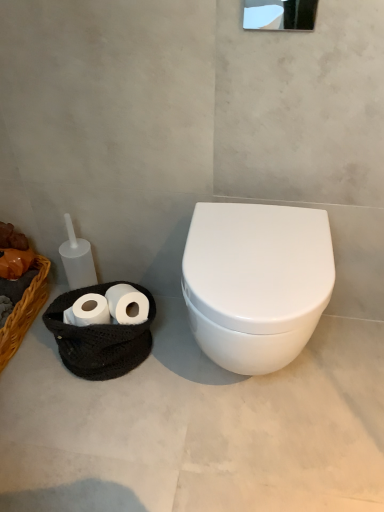
What do you see at coordinates (197, 426) in the screenshot? The height and width of the screenshot is (512, 384). I see `white glossy toilet at right` at bounding box center [197, 426].

Where is `white glossy toilet at center`? white glossy toilet at center is located at coordinates (256, 282).

What do you see at coordinates (256, 282) in the screenshot? I see `white glossy toilet at center` at bounding box center [256, 282].

In order to face white glossy mirror at upper center, should I rotate leftwards or rightwards?

Rotate right and turn 11.727 degrees.

Identify the location of white glossy mirror at upper center. The width and height of the screenshot is (384, 512). (280, 14).

I want to click on white matte toilet paper at lower left, so click(99, 339).

This screenshot has height=512, width=384. What are the coordinates of `braided wicker basket at left` in the screenshot? It's located at (24, 311).

Is white matte toilet paper at lower left spatially inside braided wicker basket at left, or outside of it?

white matte toilet paper at lower left exists outside the volume of braided wicker basket at left.

What are the coordinates of `basket above the white matte toilet paper at lower left (from the image's perspective)` in the screenshot? It's located at (24, 311).

Is white matte toilet paper at lower left facing away from braided wicker basket at left?

No, white matte toilet paper at lower left is not facing the opposite direction of braided wicker basket at left.

Locate an element on the screen. The width and height of the screenshot is (384, 512). basket on the left of white glossy toilet at center is located at coordinates (24, 311).

Between point (197, 232) and point (0, 367), which one is positioned behind?

The point (0, 367) is more distant.

Does white glossy toilet at center have a lesser height compared to braided wicker basket at left?

Incorrect, the height of white glossy toilet at center does not fall short of that of braided wicker basket at left.

Is white matte toilet paper at lower left far from white glossy toilet at center?

No.

From a real-world perspective, is white matte toilet paper at lower left over white glossy toilet at center?

Incorrect, from a real-world perspective, white matte toilet paper at lower left is lower than white glossy toilet at center.

Is white glossy toilet at center at the back of white matte toilet paper at lower left?

No, white matte toilet paper at lower left is not facing the opposite direction of white glossy toilet at center.

What's the angular difference between white matte toilet paper at lower left and white glossy toilet at center's facing directions?

28 degrees separate the facing orientations of white matte toilet paper at lower left and white glossy toilet at center.

Considering the relative sizes of white glossy toilet at right and white matte toilet paper at lower left in the image provided, is white glossy toilet at right thinner than white matte toilet paper at lower left?

In fact, white glossy toilet at right might be wider than white matte toilet paper at lower left.

From a real-world perspective, is white glossy toilet at right located higher than white matte toilet paper at lower left?

No, from a real-world perspective, white glossy toilet at right is not on top of white matte toilet paper at lower left.

Where is `porcelain located on the left of white glossy toilet at right`? porcelain located on the left of white glossy toilet at right is located at coordinates (99, 339).

Which of these two, white glossy toilet at right or white matte toilet paper at lower left, is smaller?

Smaller between the two is white matte toilet paper at lower left.

Is the depth of braided wicker basket at left less than that of white glossy toilet at right?

No.

Looking at this image, is braided wicker basket at left facing towards white glossy toilet at right?

No, braided wicker basket at left is not turned towards white glossy toilet at right.

Between braided wicker basket at left and white glossy toilet at right, which one appears on the left side from the viewer's perspective?

Positioned to the left is braided wicker basket at left.

From a real-world perspective, relative to white matte toilet paper at lower left, is white glossy mirror at upper center vertically above or below?

From a real-world perspective, white glossy mirror at upper center is physically above white matte toilet paper at lower left.

From the image's perspective, which is below, white glossy mirror at upper center or white matte toilet paper at lower left?

white matte toilet paper at lower left, from the image's perspective.

Who is more distant, white glossy mirror at upper center or white matte toilet paper at lower left?

white matte toilet paper at lower left is further away from the camera.

Based on the photo, from the image's perspective, who appears lower, white glossy toilet at right or white glossy toilet at center?

white glossy toilet at right.

Does point (371, 486) lie in front of point (260, 227)?

Yes, point (371, 486) is closer to viewer.

Which of these two, white glossy toilet at right or white glossy toilet at center, is thinner?

With smaller width is white glossy toilet at center.

Between white glossy toilet at right and white glossy toilet at center, which one has more height?

Standing taller between the two is white glossy toilet at center.

Where is `porcelain that appears below the braided wicker basket at left (from the image's perspective)`? porcelain that appears below the braided wicker basket at left (from the image's perspective) is located at coordinates (99, 339).

This screenshot has height=512, width=384. In order to click on basket below the white glossy toilet at center (from a real-world perspective) in this screenshot , I will do `click(24, 311)`.

In the scene shown: Considering their positions, is white glossy toilet at right positioned closer to braided wicker basket at left than white glossy toilet at center?

The object closer to braided wicker basket at left is white glossy toilet at right.

Which object lies further to the anchor point white glossy toilet at center, white matte toilet paper at lower left or white glossy mirror at upper center?

The object further to white glossy toilet at center is white glossy mirror at upper center.

Considering their positions, is white glossy mirror at upper center positioned further to white matte toilet paper at lower left than braided wicker basket at left?

Based on the image, white glossy mirror at upper center appears to be further to white matte toilet paper at lower left.

Based on their spatial positions, is white glossy mirror at upper center or white glossy toilet at center further from braided wicker basket at left?

white glossy mirror at upper center.

Consider the image. When comparing their distances from white matte toilet paper at lower left, does white glossy mirror at upper center or white glossy toilet at right seem further?

white glossy mirror at upper center.

Which object lies nearer to the anchor point white glossy toilet at center, white glossy toilet at right or white matte toilet paper at lower left?

The object closer to white glossy toilet at center is white glossy toilet at right.

From the image, which object appears to be farther from white glossy mirror at upper center, white matte toilet paper at lower left or white glossy toilet at center?

white matte toilet paper at lower left.

When comparing their distances from braided wicker basket at left, does white glossy toilet at right or white glossy mirror at upper center seem further?

white glossy mirror at upper center.

Find the location of a particular element. Image resolution: width=384 pixels, height=512 pixels. concrete between braided wicker basket at left and white glossy toilet at center in the horizontal direction is located at coordinates (197, 426).

This screenshot has width=384, height=512. In order to click on porcelain between white glossy mirror at upper center and white glossy toilet at right from top to bottom in this screenshot , I will do `click(99, 339)`.

What are the coordinates of `basket between white glossy mirror at upper center and white matte toilet paper at lower left vertically` in the screenshot? It's located at (24, 311).

Identify the location of toilet between white glossy mirror at upper center and white matte toilet paper at lower left from top to bottom. (256, 282).